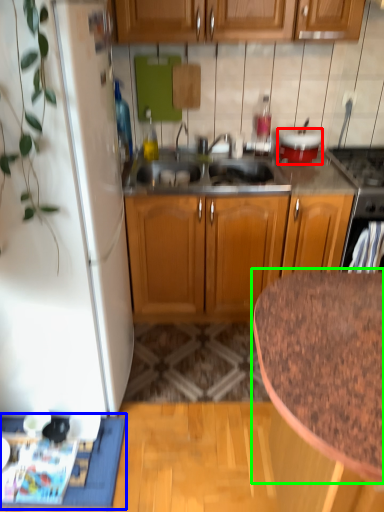
Question: Estimate the real-world distances between objects in this image. Which object is closer to appliance (highlighted by a red box), doormat (highlighted by a blue box) or countertop (highlighted by a green box)?

Choices:
 (A) doormat
 (B) countertop

Answer: (B)